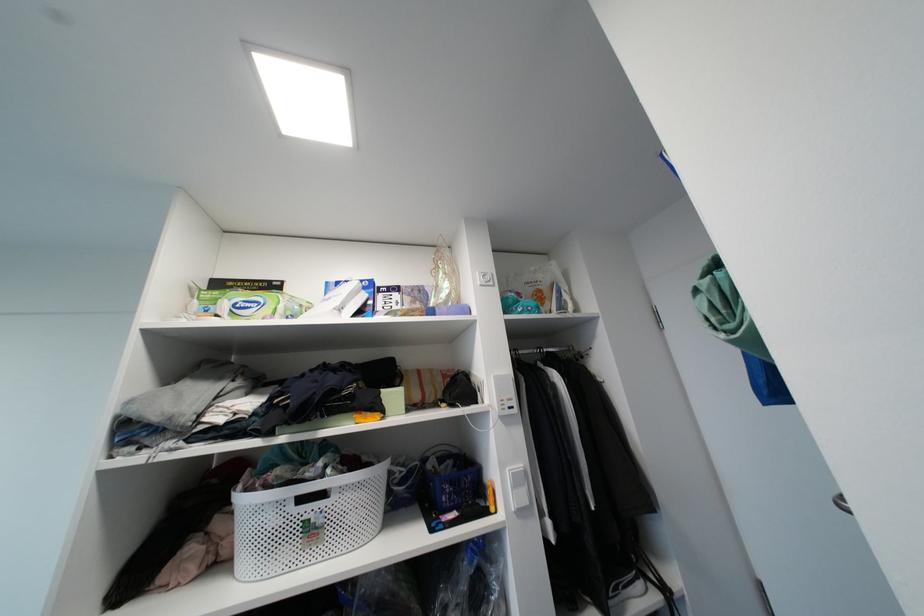
This screenshot has width=924, height=616. What do you see at coordinates (517, 304) in the screenshot?
I see `the blue gaming controller` at bounding box center [517, 304].